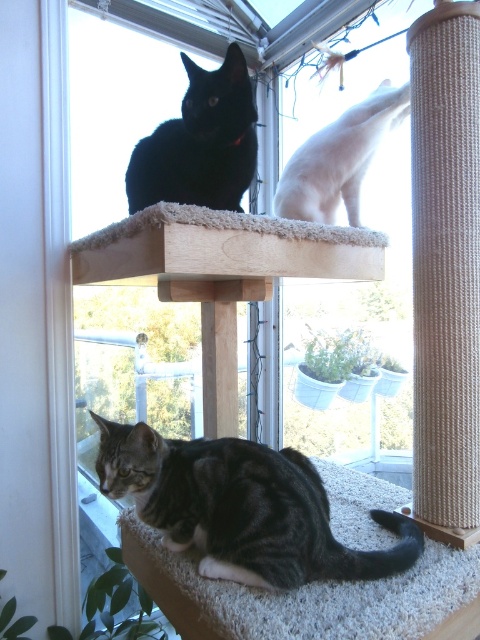
Is tabby fur cat at lower center wider than shiny black cat at upper center?

Indeed, tabby fur cat at lower center has a greater width compared to shiny black cat at upper center.

Image resolution: width=480 pixels, height=640 pixels. I want to click on tabby fur cat at lower center, so click(241, 508).

Does sisal rope scratching post at right appear on the left side of shiny black cat at upper center?

In fact, sisal rope scratching post at right is to the right of shiny black cat at upper center.

Between sisal rope scratching post at right and shiny black cat at upper center, which one appears on the left side from the viewer's perspective?

From the viewer's perspective, shiny black cat at upper center appears more on the left side.

Is point (455, 237) positioned behind point (225, 145)?

No, (455, 237) is closer to viewer.

Where is `sisal rope scratching post at right`? sisal rope scratching post at right is located at coordinates (445, 266).

Which is in front, point (280, 554) or point (279, 198)?

Point (280, 554) is more forward.

Is tabby fur cat at lower center taller than white fur cat at upper right?

Incorrect, tabby fur cat at lower center's height is not larger of white fur cat at upper right's.

Is point (262, 561) behind point (380, 129)?

No, it is in front of (380, 129).

At what (x,y) coordinates should I click in order to perform the action: click on tabby fur cat at lower center. Please return your answer as a coordinate pair (x, y). This screenshot has height=640, width=480. Looking at the image, I should click on (241, 508).